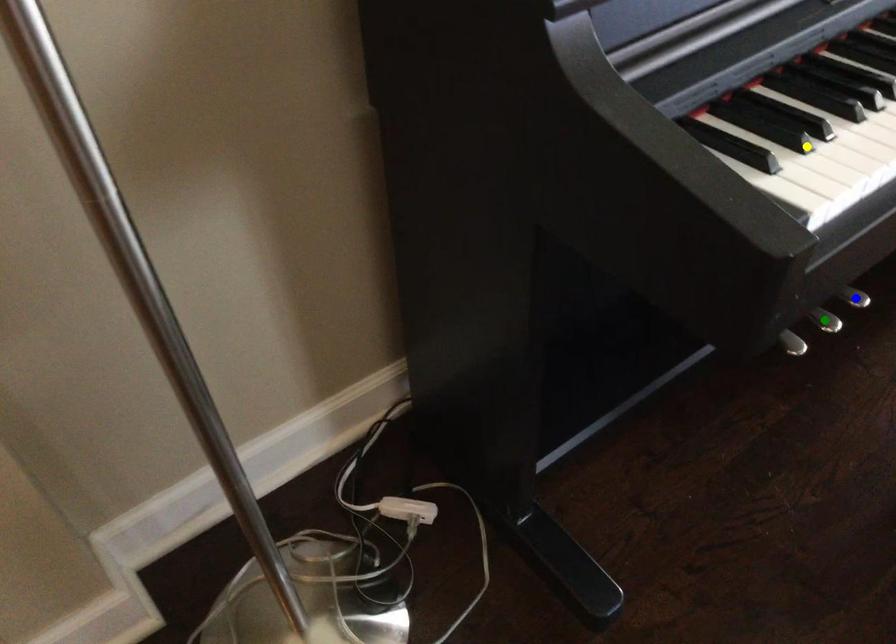
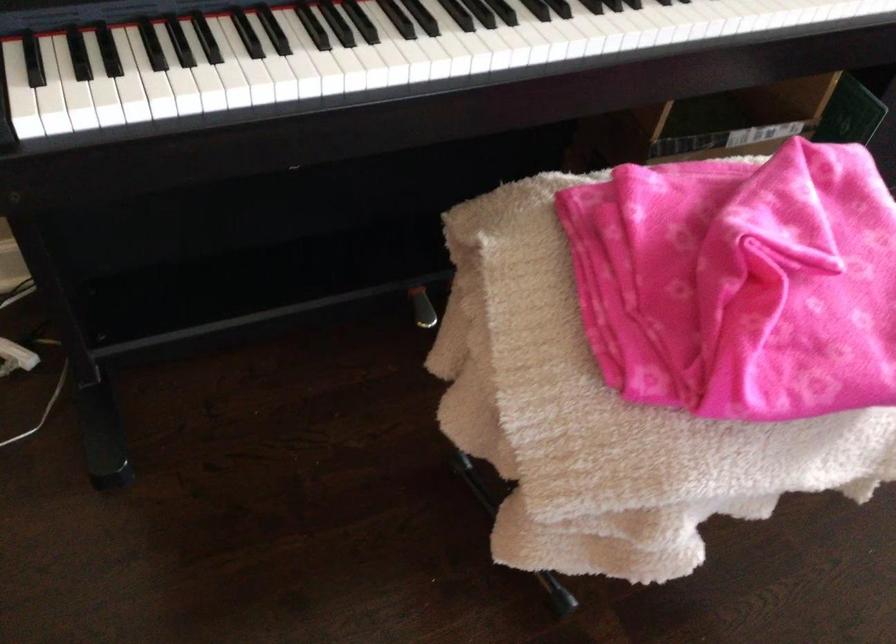
I am providing you with two images of the same scene from different viewpoints. Three points are marked in image1. Which point corresponds to a part or object that is occluded in image2?In image1, three points are marked. Which of them correspond to a part or object that is occluded in image2?Among the three points shown in image1, which one corresponds to a part or object that is no longer visible due to occlusion in image2?

green point, blue point cannot be seen in image2.